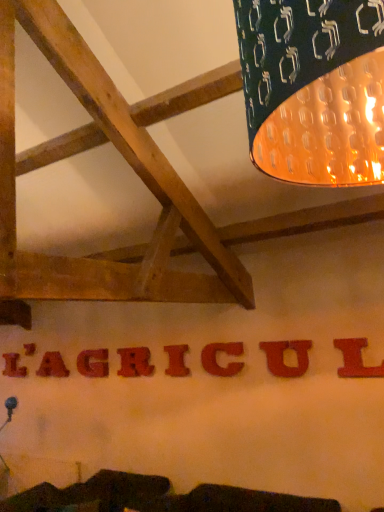
Question: Is matte red letter at center, arranged as the 5th letter when viewed from the front, wider than red matte letter l at center, the ninth letter from the left?

Choices:
 (A) yes
 (B) no

Answer: (A)

Question: From the image's perspective, does matte red letter at center, arranged as the 5th letter when viewed from the front, appear lower than red matte letter l at center, acting as the 1th letter starting from the front?

Choices:
 (A) no
 (B) yes

Answer: (B)

Question: From the image's perspective, is matte red letter at center, marked as the 5th letter in a back-to-front arrangement, above red matte letter l at center, acting as the 1th letter starting from the front?

Choices:
 (A) no
 (B) yes

Answer: (A)

Question: From a real-world perspective, does matte red letter at center, the fifth letter in the left-to-right sequence, sit lower than red matte letter l at center, acting as the 1th letter starting from the front?

Choices:
 (A) no
 (B) yes

Answer: (A)

Question: Is matte red letter at center, the fifth letter in the left-to-right sequence, facing towards red matte letter l at center, the ninth letter from the left?

Choices:
 (A) yes
 (B) no

Answer: (B)

Question: Considering the relative sizes of matte red letter at center, the fifth letter in the left-to-right sequence, and red matte letter l at center, the ninth letter from the left, in the image provided, is matte red letter at center, the fifth letter in the left-to-right sequence, taller than red matte letter l at center, the ninth letter from the left,?

Choices:
 (A) no
 (B) yes

Answer: (B)

Question: Is matte red letter u at center, which is the 2th letter from right to left, at the left side of red matte letter at center, acting as the seventh letter starting from the front?

Choices:
 (A) yes
 (B) no

Answer: (B)

Question: Considering the relative positions of matte red letter u at center, positioned as the 8th letter in left-to-right order, and red matte letter at center, placed as the 7th letter when sorted from right to left, in the image provided, is matte red letter u at center, positioned as the 8th letter in left-to-right order, in front of red matte letter at center, placed as the 7th letter when sorted from right to left,?

Choices:
 (A) yes
 (B) no

Answer: (A)

Question: From the image's perspective, is matte red letter u at center, positioned as the 8th letter in left-to-right order, beneath red matte letter at center, which appears as the 3th letter when viewed from the left?

Choices:
 (A) no
 (B) yes

Answer: (A)

Question: Is matte red letter u at center, arranged as the 8th letter when viewed from the back, positioned with its back to red matte letter at center, which ranks as the third letter in back-to-front order?

Choices:
 (A) no
 (B) yes

Answer: (A)

Question: Is matte red letter u at center, which ranks as the second letter in front-to-back order, taller than red matte letter at center, placed as the 7th letter when sorted from right to left?

Choices:
 (A) no
 (B) yes

Answer: (A)

Question: Can red matte letter at center, acting as the seventh letter starting from the front, be found inside matte red letter u at center, which ranks as the second letter in front-to-back order?

Choices:
 (A) yes
 (B) no

Answer: (B)

Question: Are matte red letter g at center, placed as the sixth letter when sorted from right to left, and matte red letter at center, arranged as the 7th letter when viewed from the back, making contact?

Choices:
 (A) yes
 (B) no

Answer: (B)